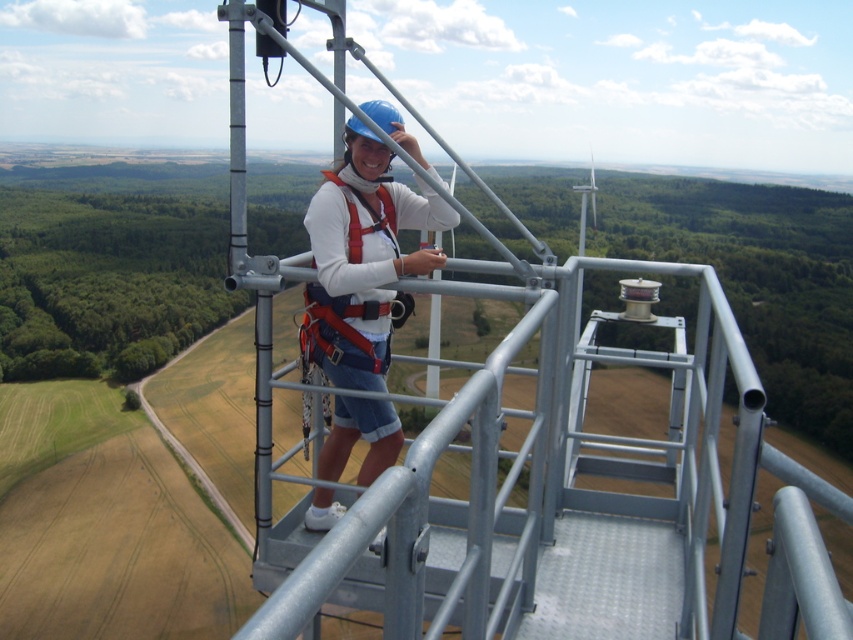
Is the position of matte white shirt at center more distant than that of red nylon safety vest at center?

No, matte white shirt at center is closer to the viewer.

How much distance is there between matte white shirt at center and red nylon safety vest at center?

12.57 inches

Is point (332, 310) farther from viewer compared to point (358, 304)?

No, (332, 310) is closer to viewer.

The width and height of the screenshot is (853, 640). I want to click on matte white shirt at center, so click(x=364, y=257).